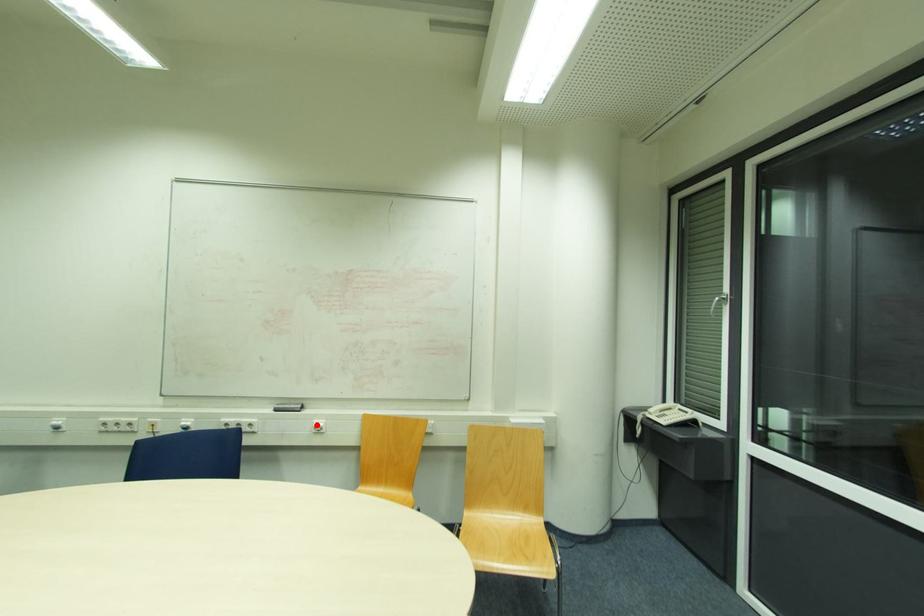
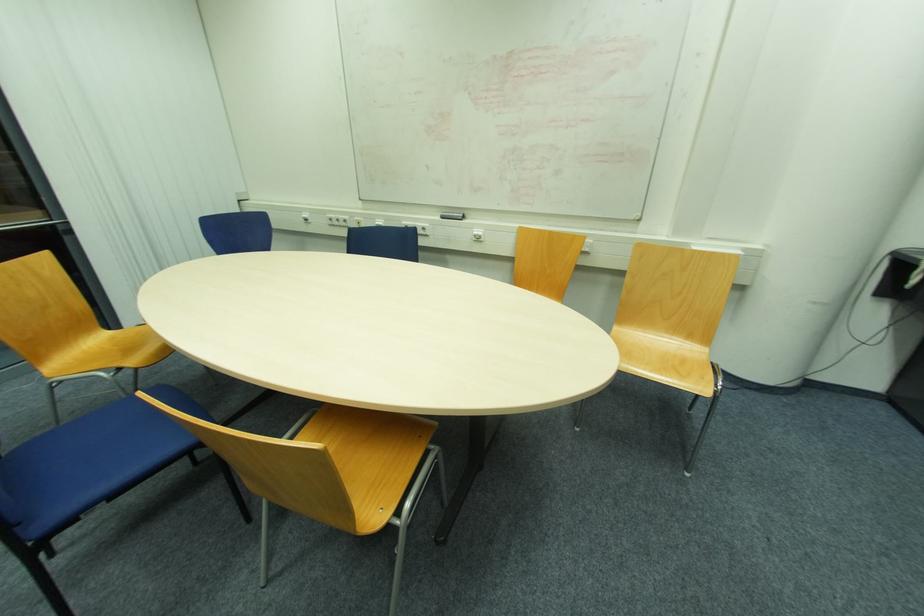
Question: I am providing you with two images of the same scene from different viewpoints. In image1, a red point is highlighted. Considering the same 3D point in image2, which of the following is correct?

Choices:
 (A) It is closer
 (B) It is farther

Answer: (A)